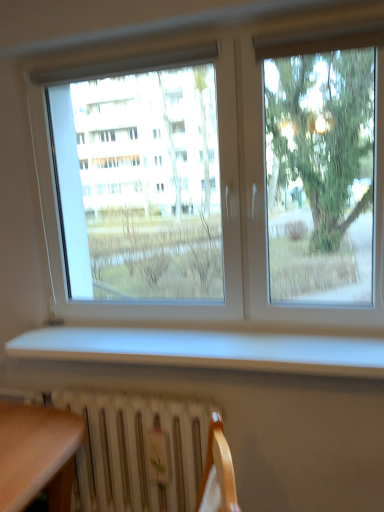
Question: Is transparent glass window at center in front of or behind white matte window sill at lower center in the image?

Choices:
 (A) front
 (B) behind

Answer: (B)

Question: Would you say transparent glass window at center is to the left or to the right of white matte window sill at lower center in the picture?

Choices:
 (A) right
 (B) left

Answer: (A)

Question: Which is farther from the white matte window sill at lower center?

Choices:
 (A) transparent glass window at center
 (B) white metallic radiator at lower center

Answer: (A)

Question: Based on their relative distances, which object is nearer to the transparent glass window at center?

Choices:
 (A) white metallic radiator at lower center
 (B) white matte window sill at lower center

Answer: (A)